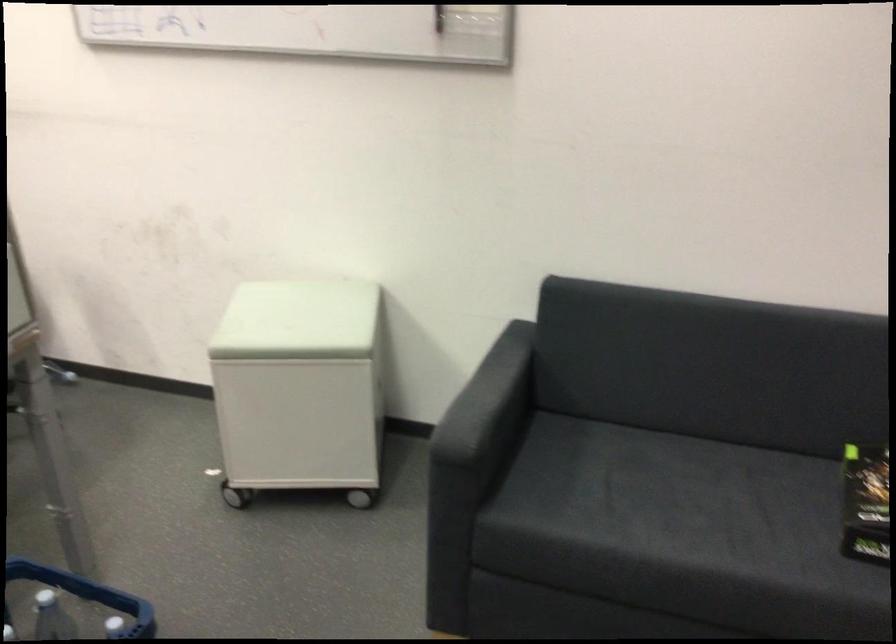
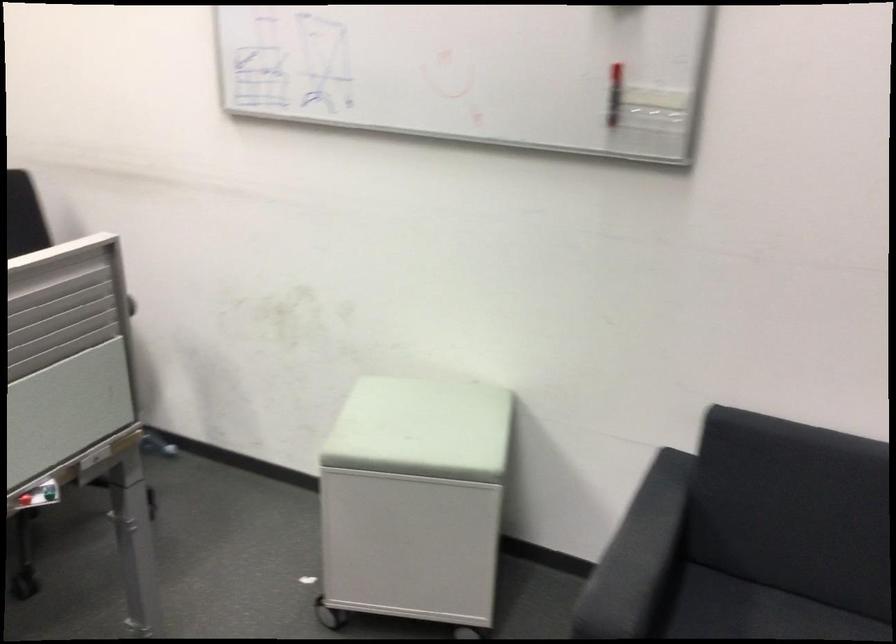
What movement of the cameraman would produce the second image?

The cameraman walked toward left, forward.